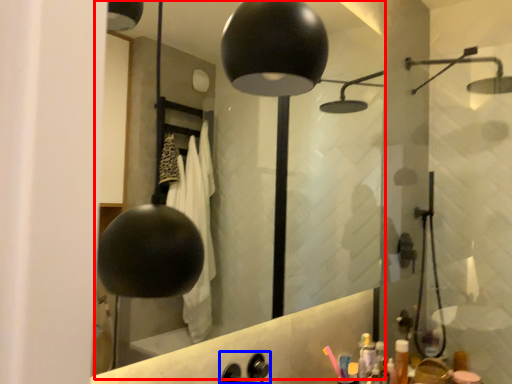
Question: Which object is further to the camera taking this photo, mirror (highlighted by a red box) or faucet (highlighted by a blue box)?

Choices:
 (A) mirror
 (B) faucet

Answer: (B)